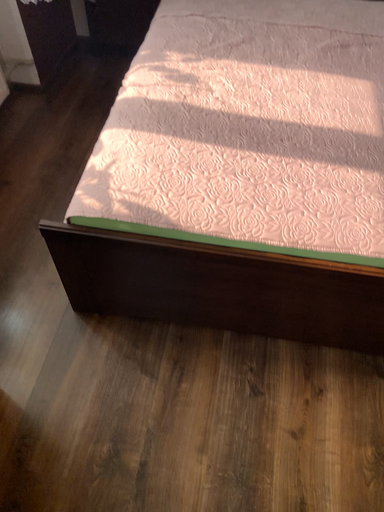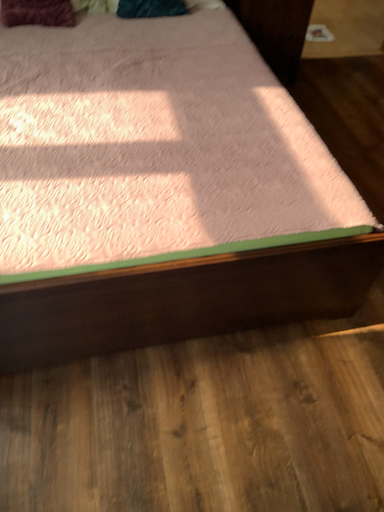
Question: Which way did the camera rotate in the video?

Choices:
 (A) rotated left
 (B) rotated right

Answer: (B)